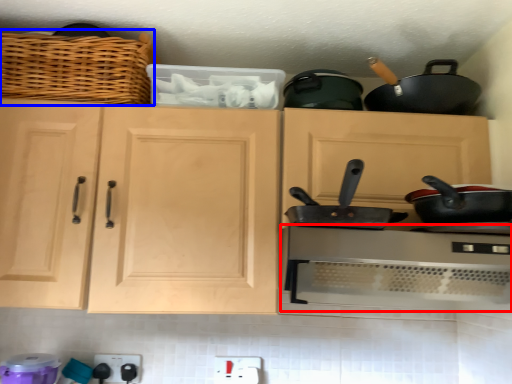
Question: Among these objects, which one is farthest to the camera, home appliance (highlighted by a red box) or basket (highlighted by a blue box)?

Choices:
 (A) home appliance
 (B) basket

Answer: (B)